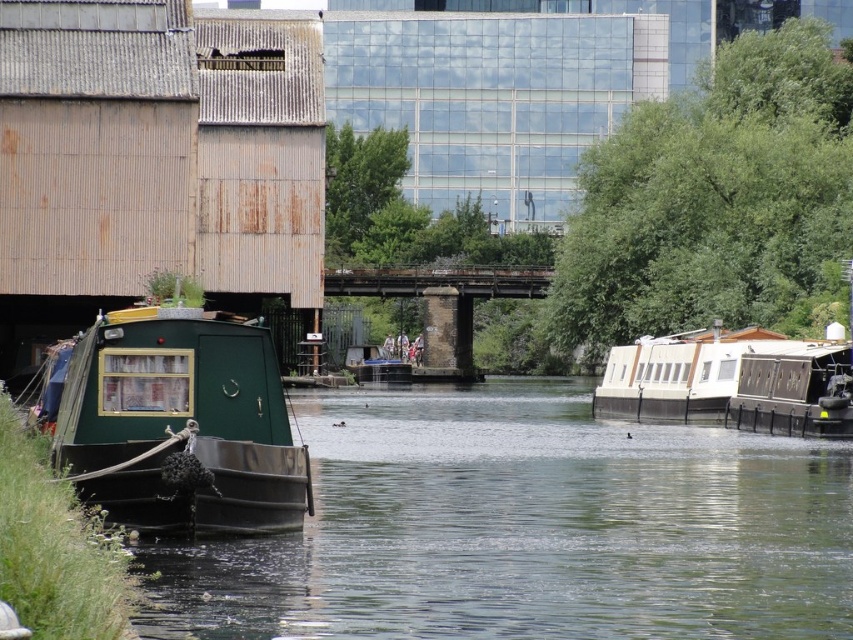
You are standing on the weathered corrugated metal building on the left side of the canal. Looking down at the water, you see the green matte boat at left and the green matte houseboat at left. Which one is positioned more to your right side?

The green matte boat at left is positioned to the right of the green matte houseboat at left, so from your vantage point on the building, the green matte boat at left would be more to your right side.

You are standing on the dock and want to board the green matte houseboat at left and the white glossy houseboat at right. Which one is closer to the dock?

The green matte houseboat at left is closer to the dock because it is positioned to the left of the white glossy houseboat at right, which is further away.

You are a photographer standing at the edge of the canal in the scene. You want to take a photo that includes both the dark green boat with a yellow window and the white boat with brown accents. However, you notice two points marked on your viewfinder at coordinates point (186, 609) and point (163, 516). Which point should you focus on to ensure both boats are in sharp focus?

You should focus on point (186, 609) because it is closer to the camera than point (163, 516). By focusing on the closer point, the depth of field will likely include both boats in sharp focus.